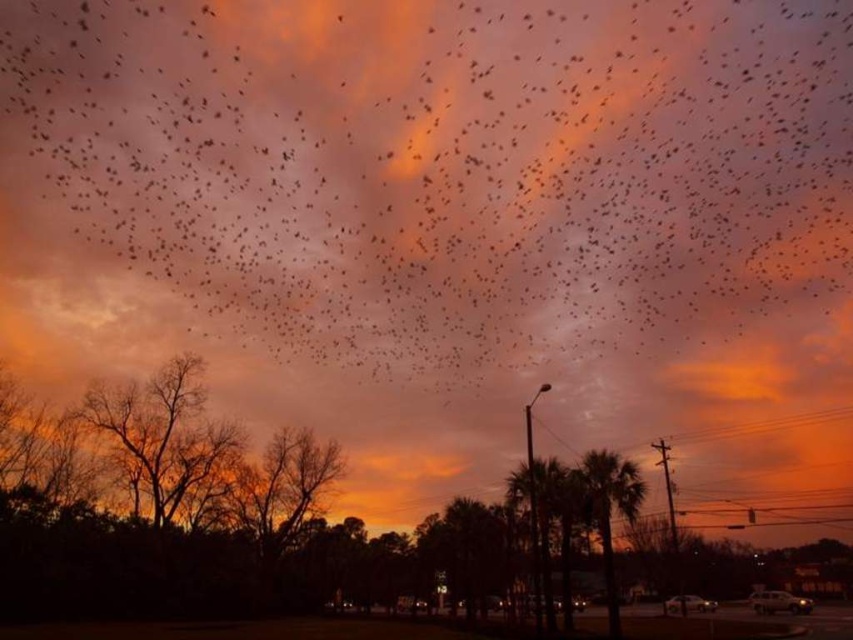
Does black matte birds at upper center have a greater width compared to green leafy palm tree at center?

Yes, black matte birds at upper center is wider than green leafy palm tree at center.

Is point (339, 344) closer to camera compared to point (592, 477)?

No, (339, 344) is behind (592, 477).

Find the location of a particular element. This screenshot has height=640, width=853. black matte birds at upper center is located at coordinates [x=447, y=163].

Between black matte birds at upper center and brown leafless tree at left, which one appears on the right side from the viewer's perspective?

black matte birds at upper center

Between point (834, 285) and point (195, 372), which one is positioned behind?

The point (834, 285) is behind.

Does point (790, 284) lie behind point (142, 452)?

Yes, it is.

In order to click on black matte birds at upper center in this screenshot , I will do `click(447, 163)`.

Is brown leafless tree at left thinner than green leafy palm tree at center?

Incorrect, brown leafless tree at left's width is not less than green leafy palm tree at center's.

Measure the distance between point (161, 442) and camera.

A distance of 320.24 meters exists between point (161, 442) and camera.

Where is `brown leafless tree at left`? The image size is (853, 640). brown leafless tree at left is located at coordinates coord(167,440).